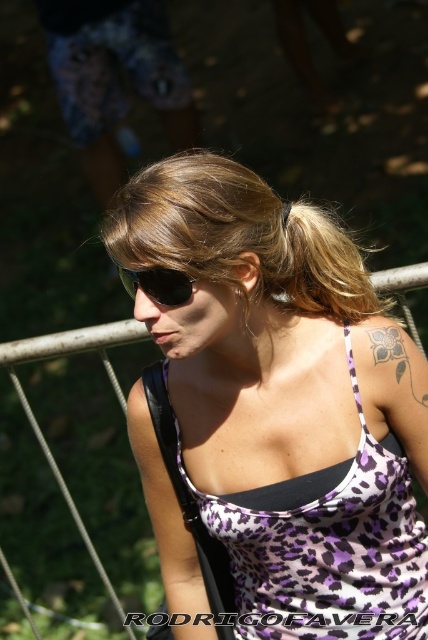
Who is positioned more to the left, purple leopard print tank top at center or gray/black ink flower at upper right?

From the viewer's perspective, purple leopard print tank top at center appears more on the left side.

Describe the element at coordinates (281, 403) in the screenshot. I see `purple leopard print tank top at center` at that location.

Which is in front, point (303, 298) or point (398, 374)?

Point (398, 374)

Where is `purple leopard print tank top at center`? The height and width of the screenshot is (640, 428). purple leopard print tank top at center is located at coordinates (281, 403).

Is point (163, 381) more distant than point (155, 269)?

Yes, it is.

Who is positioned more to the left, black leather strap at upper center or black plastic sunglasses at center?

black plastic sunglasses at center is more to the left.

Which is behind, point (151, 365) or point (177, 280)?

The point (151, 365) is more distant.

Where is `black leather strap at upper center`? This screenshot has height=640, width=428. black leather strap at upper center is located at coordinates (192, 508).

Is purple leopard print tank top at center wider than black leather strap at upper center?

Yes.

Between point (309, 292) and point (148, 632), which one is positioned behind?

The point (148, 632) is more distant.

Which is in front, point (187, 228) or point (158, 374)?

Positioned in front is point (187, 228).

You are a GUI agent. You are given a task and a screenshot of the screen. Output one action in this format:
    pyautogui.click(x=<x>, y=<y>)
    Task: Click on the purple leopard print tank top at center
    
    Given the screenshot: What is the action you would take?
    pyautogui.click(x=281, y=403)